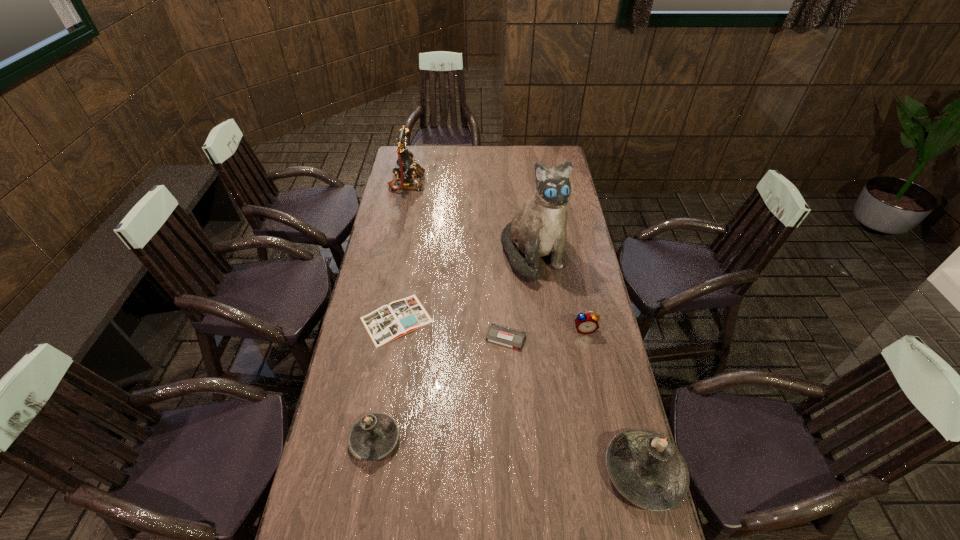
The image size is (960, 540). Identify the location of the shorter candle. (373, 436).

Locate an element on the screen. the left candle is located at coordinates (373, 436).

Locate an element on the screen. the fifth shortest object is located at coordinates (646, 468).

This screenshot has width=960, height=540. Identify the location of the right candle. (646, 468).

Locate an element on the screen. Image resolution: width=960 pixels, height=540 pixels. the farthest object is located at coordinates (405, 168).

Image resolution: width=960 pixels, height=540 pixels. I want to click on telephone, so click(x=405, y=168).

The image size is (960, 540). I want to click on the sixth nearest object, so click(x=538, y=229).

Image resolution: width=960 pixels, height=540 pixels. I want to click on the tallest object, so coord(538,229).

Image resolution: width=960 pixels, height=540 pixels. I want to click on videotape, so click(498, 334).

Where is `book`? The width and height of the screenshot is (960, 540). book is located at coordinates (400, 317).